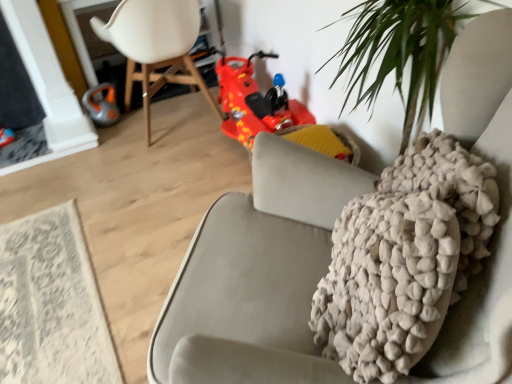
Question: Considering the positions of shiny red plastic toy car at center and white plastic chair at upper left in the image, is shiny red plastic toy car at center taller or shorter than white plastic chair at upper left?

Choices:
 (A) short
 (B) tall

Answer: (A)

Question: Is shiny red plastic toy car at center inside or outside of white plastic chair at upper left?

Choices:
 (A) outside
 (B) inside

Answer: (A)

Question: Which of these objects is positioned farthest from the orange rubber vacuum cleaner at left?

Choices:
 (A) shiny red plastic toy car at center
 (B) white plastic chair at upper left
 (C) white textured rug at lower left

Answer: (C)

Question: Which object is positioned farthest from the shiny red plastic toy car at center?

Choices:
 (A) white textured rug at lower left
 (B) orange rubber vacuum cleaner at left
 (C) white plastic chair at upper left

Answer: (A)